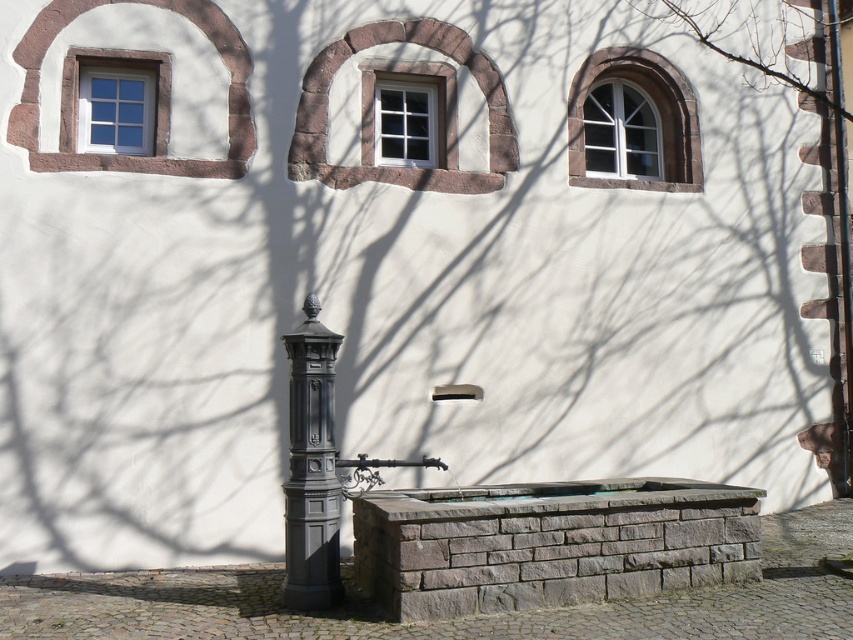
Does white glass window at center lie in front of matte white window at upper left?

No, it is not.

Which of these two, white glass window at center or matte white window at upper left, stands shorter?

matte white window at upper left

Who is more distant from viewer, (445, 150) or (160, 83)?

Positioned behind is point (445, 150).

Find the location of `white glass window at center`. white glass window at center is located at coordinates (410, 120).

Which of these two, matte black post at center or matte white window at upper left, stands taller?

Standing taller between the two is matte black post at center.

Does point (286, 536) lie behind point (74, 113)?

No.

The image size is (853, 640). I want to click on matte black post at center, so click(x=311, y=467).

Does point (422, 134) come closer to viewer compared to point (602, 100)?

Yes, point (422, 134) is in front of point (602, 100).

Is white glass window at center below white glass window at upper right?

No.

Is point (433, 77) positioned before point (653, 145)?

Yes, point (433, 77) is in front of point (653, 145).

The height and width of the screenshot is (640, 853). Find the location of `white glass window at center`. white glass window at center is located at coordinates (410, 120).